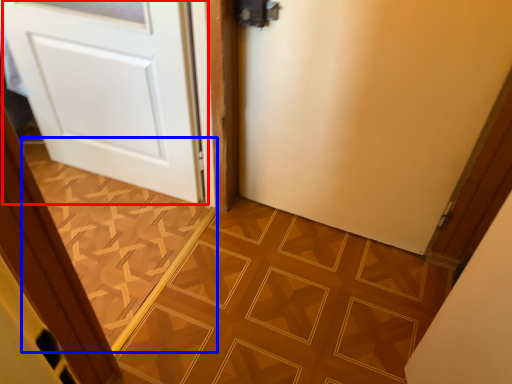
Question: Among these objects, which one is nearest to the camera, door (highlighted by a red box) or ceramic tile (highlighted by a blue box)?

Choices:
 (A) door
 (B) ceramic tile

Answer: (A)